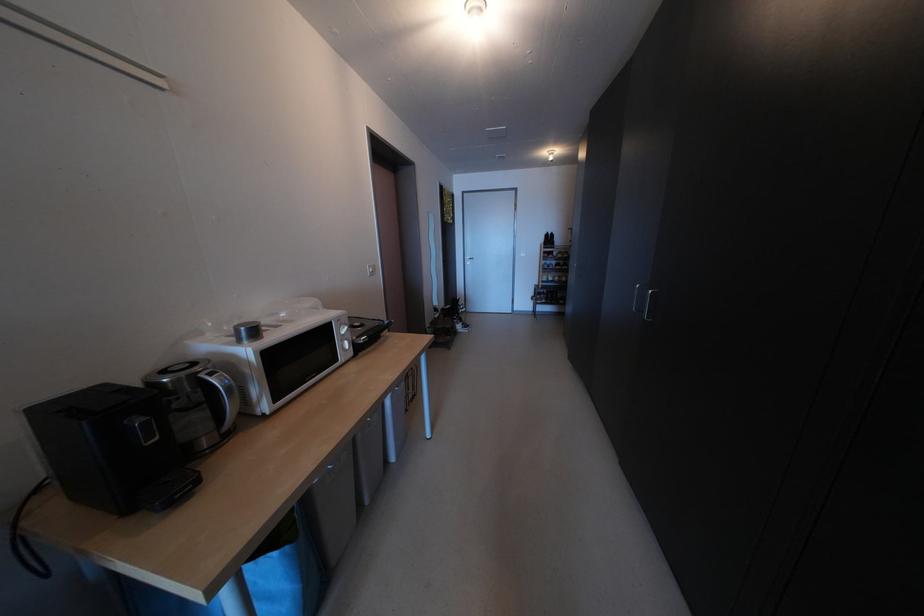
The height and width of the screenshot is (616, 924). What do you see at coordinates (642, 301) in the screenshot?
I see `a silver cabinet handle` at bounding box center [642, 301].